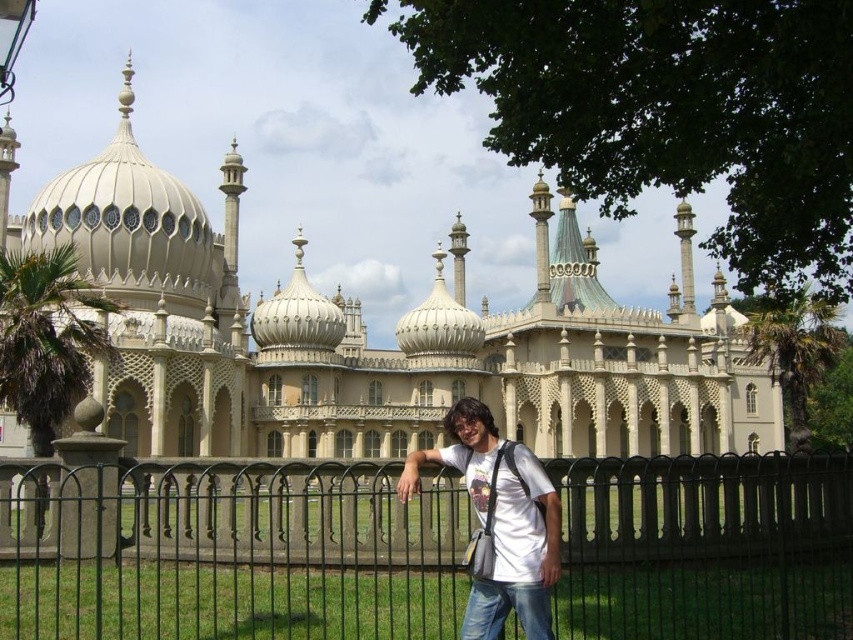
Question: Is black metal fence at center thinner than white stone palace at center?

Choices:
 (A) no
 (B) yes

Answer: (B)

Question: Can you confirm if black metal fence at center is positioned to the right of white stone palace at center?

Choices:
 (A) no
 (B) yes

Answer: (B)

Question: Can you confirm if white stone palace at center is positioned to the right of white matte t-shirt at center?

Choices:
 (A) yes
 (B) no

Answer: (B)

Question: Which point is farther from the camera taking this photo?

Choices:
 (A) (381, 557)
 (B) (485, 394)
 (C) (468, 481)

Answer: (B)

Question: Among these objects, which one is farthest from the camera?

Choices:
 (A) black metal fence at center
 (B) white matte t-shirt at center

Answer: (B)

Question: Which of these objects is positioned farthest from the black metal fence at center?

Choices:
 (A) white matte t-shirt at center
 (B) white stone palace at center

Answer: (B)